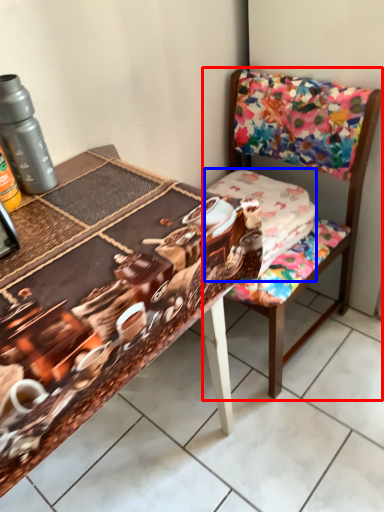
Question: Which object is closer to the camera taking this photo, chair (highlighted by a red box) or fabric (highlighted by a blue box)?

Choices:
 (A) chair
 (B) fabric

Answer: (A)